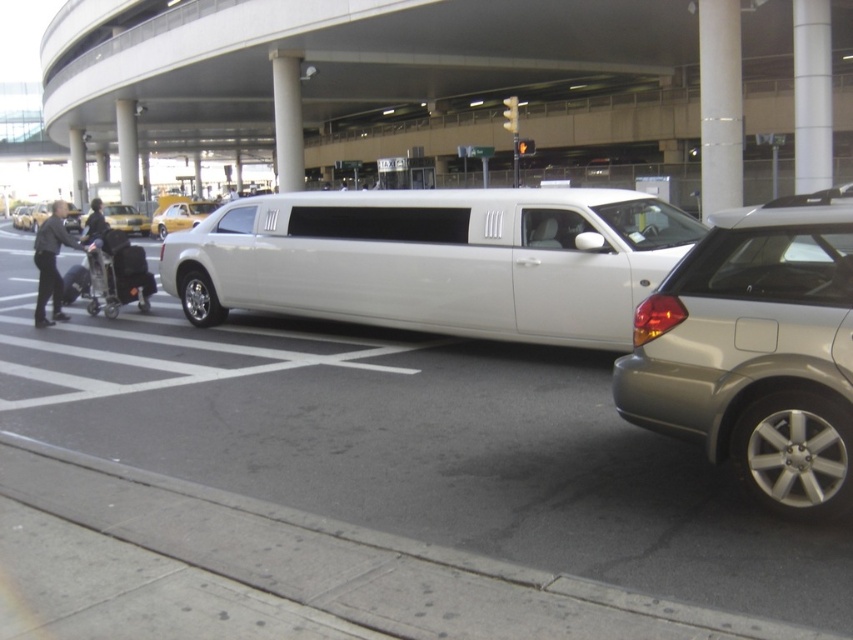
Is yellow rubber taxi at upper left shorter than yellow rubber taxi cab at left?

Yes, yellow rubber taxi at upper left is shorter than yellow rubber taxi cab at left.

In the scene shown: Is yellow rubber taxi at upper left thinner than yellow rubber taxi cab at left?

Correct, yellow rubber taxi at upper left's width is less than yellow rubber taxi cab at left's.

Does point (212, 200) come closer to viewer compared to point (18, 218)?

That is False.

Where is `yellow rubber taxi at upper left`? Image resolution: width=853 pixels, height=640 pixels. yellow rubber taxi at upper left is located at coordinates (180, 216).

Can you confirm if satin silver minivan at right is positioned above yellow taxi at left?

No, satin silver minivan at right is not above yellow taxi at left.

The image size is (853, 640). What do you see at coordinates (756, 353) in the screenshot?
I see `satin silver minivan at right` at bounding box center [756, 353].

Where is `satin silver minivan at right`? satin silver minivan at right is located at coordinates (756, 353).

Is satin silver minivan at right to the left of yellow rubber taxi cab at left from the viewer's perspective?

No, satin silver minivan at right is not to the left of yellow rubber taxi cab at left.

Is satin silver minivan at right further to the viewer compared to yellow rubber taxi cab at left?

No.

Is point (666, 380) positioned behind point (15, 227)?

That is False.

Where is `satin silver minivan at right`? The image size is (853, 640). satin silver minivan at right is located at coordinates (756, 353).